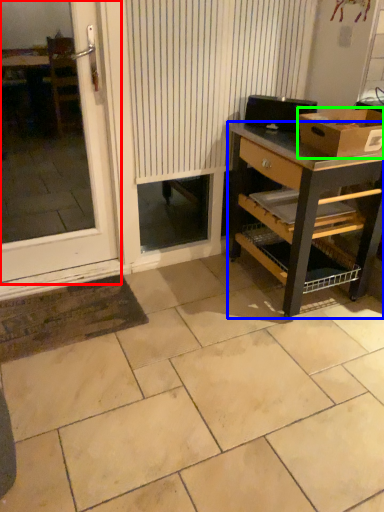
Question: Which object is positioned farthest from window (highlighted by a red box)? Select from desk (highlighted by a blue box) and box (highlighted by a green box).

Choices:
 (A) desk
 (B) box

Answer: (B)